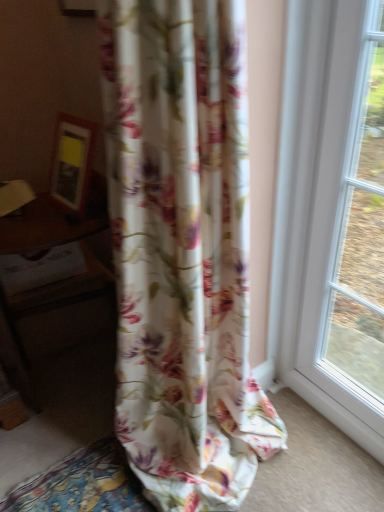
Locate an element on the screen. empty space that is ontop of wooden table at left is located at coordinates (42, 220).